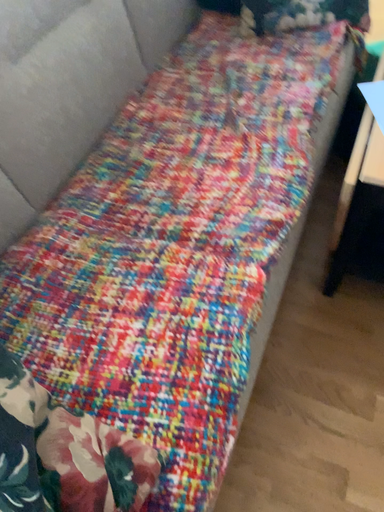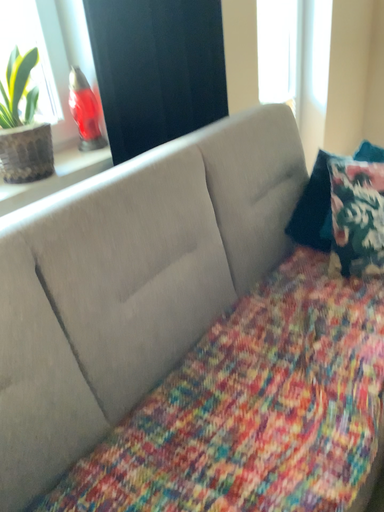
Question: Which way did the camera rotate in the video?

Choices:
 (A) rotated upward
 (B) rotated downward

Answer: (A)